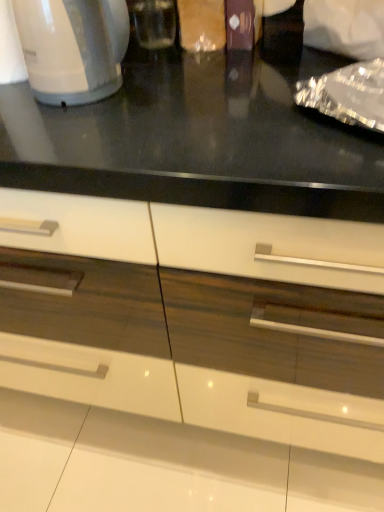
Where is `white glossy cabinet at center`? Image resolution: width=384 pixels, height=512 pixels. white glossy cabinet at center is located at coordinates coord(189,359).

Describe the element at coordinates (189, 359) in the screenshot. Image resolution: width=384 pixels, height=512 pixels. I see `white glossy cabinet at center` at that location.

What do you see at coordinates (73, 48) in the screenshot? I see `white glossy electric kettle at left` at bounding box center [73, 48].

Image resolution: width=384 pixels, height=512 pixels. Find the location of `white glossy electric kettle at left`. white glossy electric kettle at left is located at coordinates (73, 48).

Locate an element on the screen. The image size is (384, 512). white glossy cabinet at center is located at coordinates (189, 359).

From the picture: Can you confirm if white glossy electric kettle at left is positioned to the left of white glossy cabinet at center?

Correct, you'll find white glossy electric kettle at left to the left of white glossy cabinet at center.

Is white glossy electric kettle at left further to camera compared to white glossy cabinet at center?

Yes, white glossy electric kettle at left is further from the viewer.

Which point is more distant from viewer, (103,67) or (176,476)?

Point (176,476)

From the image's perspective, would you say white glossy electric kettle at left is positioned over white glossy cabinet at center?

Yes, from the image's perspective, white glossy electric kettle at left is above white glossy cabinet at center.

From a real-world perspective, who is located higher, white glossy electric kettle at left or white glossy cabinet at center?

A: white glossy electric kettle at left, from a real-world perspective.

Is white glossy electric kettle at left wider than white glossy cabinet at center?

Incorrect, the width of white glossy electric kettle at left does not surpass that of white glossy cabinet at center.

In terms of height, does white glossy electric kettle at left look taller or shorter compared to white glossy cabinet at center?

Considering their sizes, white glossy electric kettle at left has less height than white glossy cabinet at center.

Can you confirm if white glossy electric kettle at left is bigger than white glossy cabinet at center?

No, white glossy electric kettle at left is not bigger than white glossy cabinet at center.

Is white glossy electric kettle at left inside or outside of white glossy cabinet at center?

white glossy electric kettle at left cannot be found inside white glossy cabinet at center.

Would you say white glossy electric kettle at left is a long distance from white glossy cabinet at center?

Actually, white glossy electric kettle at left and white glossy cabinet at center are a little close together.

Is white glossy electric kettle at left facing towards white glossy cabinet at center?

No, white glossy electric kettle at left is not turned towards white glossy cabinet at center.

Image resolution: width=384 pixels, height=512 pixels. In order to click on home appliance to the left of white glossy cabinet at center in this screenshot , I will do `click(73, 48)`.

Can you confirm if white glossy cabinet at center is positioned to the right of white glossy electric kettle at left?

Correct, you'll find white glossy cabinet at center to the right of white glossy electric kettle at left.

Is the depth of white glossy cabinet at center less than that of white glossy electric kettle at left?

Yes, white glossy cabinet at center is closer to the camera.

Is point (246, 451) farther from viewer compared to point (60, 9)?

Yes, point (246, 451) is farther from viewer.

From the image's perspective, between white glossy cabinet at center and white glossy electric kettle at left, who is located below?

white glossy cabinet at center.

From a real-world perspective, does white glossy cabinet at center sit lower than white glossy electric kettle at left?

Correct, in the physical world, white glossy cabinet at center is lower than white glossy electric kettle at left.

In the scene shown: Does white glossy cabinet at center have a greater width compared to white glossy electric kettle at left?

Yes, white glossy cabinet at center is wider than white glossy electric kettle at left.

Who is taller, white glossy cabinet at center or white glossy electric kettle at left?

Standing taller between the two is white glossy cabinet at center.

In terms of size, does white glossy cabinet at center appear bigger or smaller than white glossy electric kettle at left?

Considering their sizes, white glossy cabinet at center takes up more space than white glossy electric kettle at left.

Is white glossy cabinet at center outside of white glossy electric kettle at left?

white glossy cabinet at center is positioned outside white glossy electric kettle at left.

Is white glossy cabinet at center positioned far away from white glossy electric kettle at left?

No, white glossy cabinet at center is not far away from white glossy electric kettle at left.

Is white glossy cabinet at center positioned with its back to white glossy electric kettle at left?

No.

Image resolution: width=384 pixels, height=512 pixels. Identify the location of cabinetry that appears below the white glossy electric kettle at left (from a real-world perspective). [189, 359].

Locate an element on the screen. The image size is (384, 512). cabinetry in front of the white glossy electric kettle at left is located at coordinates (189, 359).

Find the location of `home appliance lying above the white glossy cabinet at center (from the image's perspective)`. home appliance lying above the white glossy cabinet at center (from the image's perspective) is located at coordinates point(73,48).